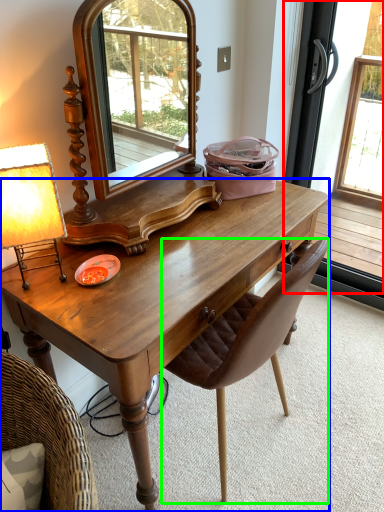
Question: Which is farther away from screen door (highlighted by a red box)? desk (highlighted by a blue box) or chair (highlighted by a green box)?

Choices:
 (A) desk
 (B) chair

Answer: (B)